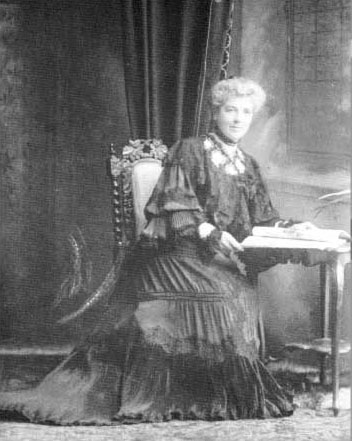
At what (x,y) coordinates should I click in order to perform the action: click on window. Please return your answer as a coordinate pair (x, y). The width and height of the screenshot is (352, 441). Looking at the image, I should click on click(333, 62).